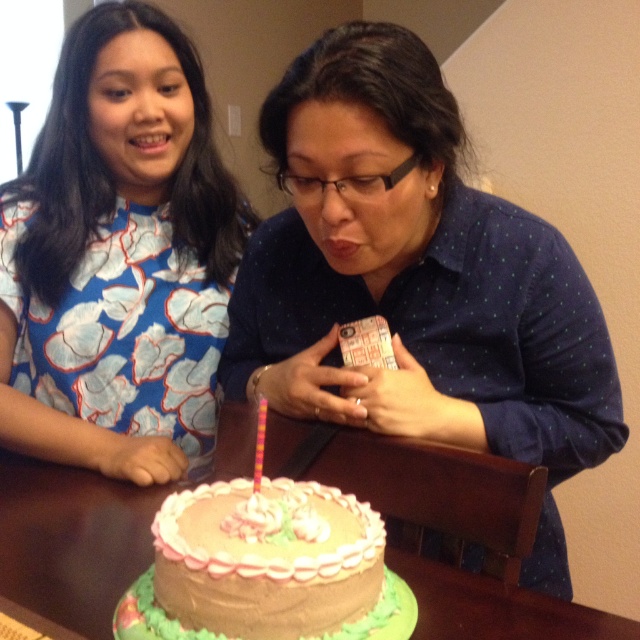
You are a photographer positioned behind the cake and want to capture both the matte blue shirt at center and the smooth wooden table at center in the same frame. Which object should you focus on first to ensure both are in focus?

Since the matte blue shirt at center is thinner than the smooth wooden table at center, you should focus on the smooth wooden table at center first to ensure both are in focus.

You are a small toy car that is 10 cm tall. You want to drive from the floor to the smooth wooden table at center. Can you see the multicolored plastic candle at center from the floor?

The smooth wooden table at center is taller than multicolored plastic candle at center. Since the table is taller than the candle, the candle might be partially or fully obscured by the table when viewed from the floor. Therefore, the toy car may not be able to see the multicolored plastic candle at center from the floor.

You are standing in a room and see the smooth wooden table at center. If you want to place a 25 inch long gift box on the table, will it fit entirely on the table?

The smooth wooden table at center and viewer are 24.20 inches apart from each other. This distance does not provide information about the table size. Therefore, it is impossible to determine if the 25 inch long gift box will fit on the table.